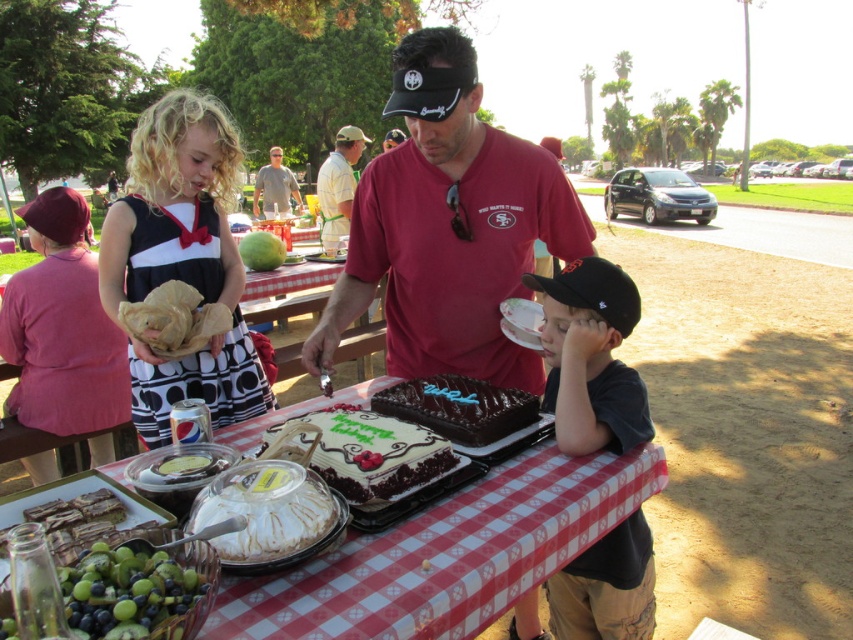
You are a guest at the party and want to grab a snack. You see the green matte grapes at lower left. Where exactly are they located on the table?

The green matte grapes at lower left are located at point coordinates of (144,593).

You are at the park and want to take a photo of both point (434, 168) and point (334, 189) in the scene. Which point should you focus on first to ensure both are in clear view?

You should focus on point (434, 168) first because it is closer to the camera than point (334, 189), ensuring both points remain in focus when using depth of field.

You are planning to serve snacks at a party and want to know if the green matte grapes at lower left can fit into a container designed for the chocolatesmoothcake at center. Based on their sizes, would this be possible?

The green matte grapes at lower left has a smaller size compared to chocolatesmoothcake at center, so it can fit into a container designed for the chocolatesmoothcake at center.